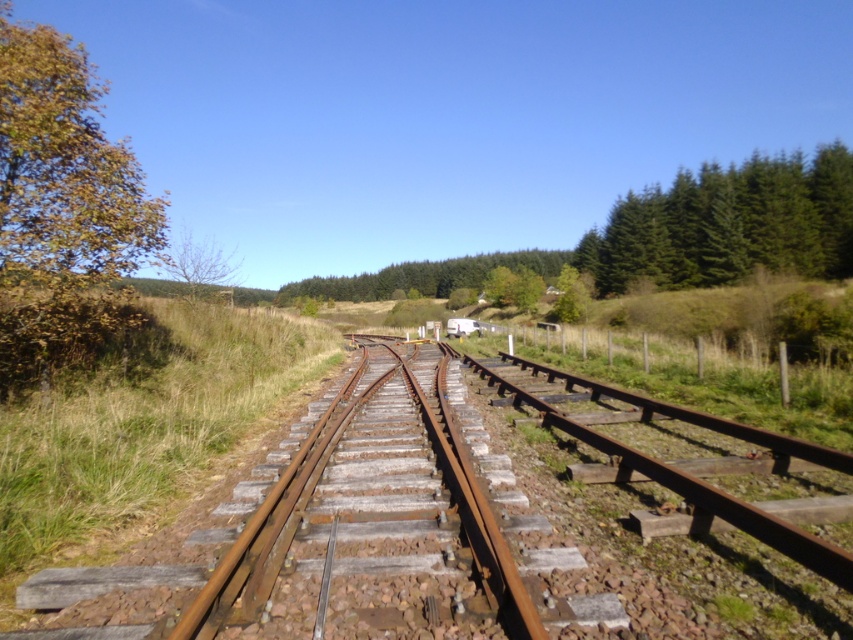
You are a bird flying over the scene. You see the rusty metal train track at center and the green coniferous trees at upper right. Which object is located above the other?

The green coniferous trees at upper right are located above the rusty metal train track at center.

You are standing at the edge of the railway and see the rusty metal train track at center and the bare branches at left. Which object is nearer to you?

The rusty metal train track at center is closer to the viewer than the bare branches at left, so the rusty metal train track at center is nearer to you.